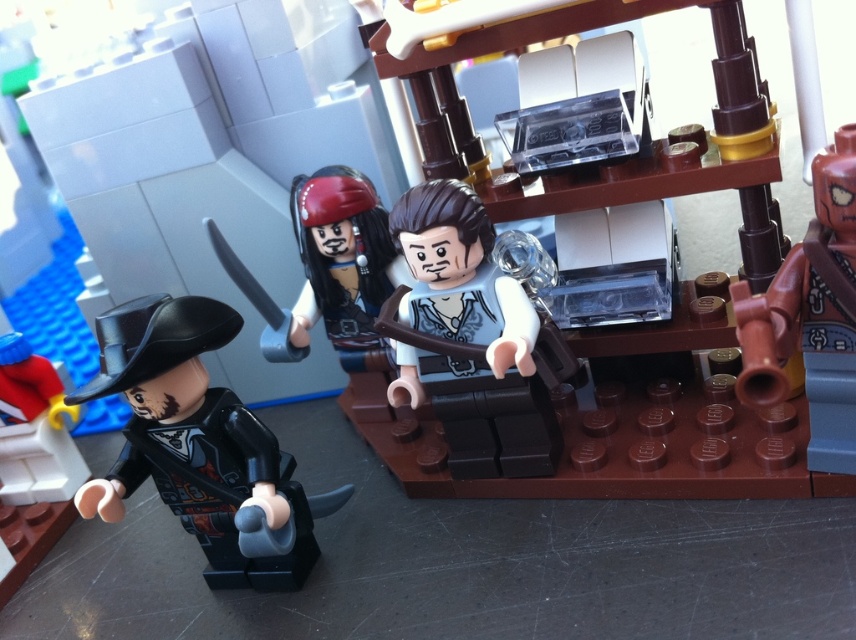
In the LEGO scene, where exactly is the black matte pirate hat at left located?

The black matte pirate hat at left is located at point coordinates of 0.697 along the x axis and 0.235 along the y axis.

You are a LEGO builder and need to place a new minifigure between the black matte pirate hat at left and the matte black hat at lower left. What is the minimum distance you should maintain between the two hats to ensure the new minifigure fits comfortably?

The minimum distance between the black matte pirate hat at left and the matte black hat at lower left is 14.91 inches. To ensure the new minifigure fits comfortably, maintain at least this distance between the two hats.